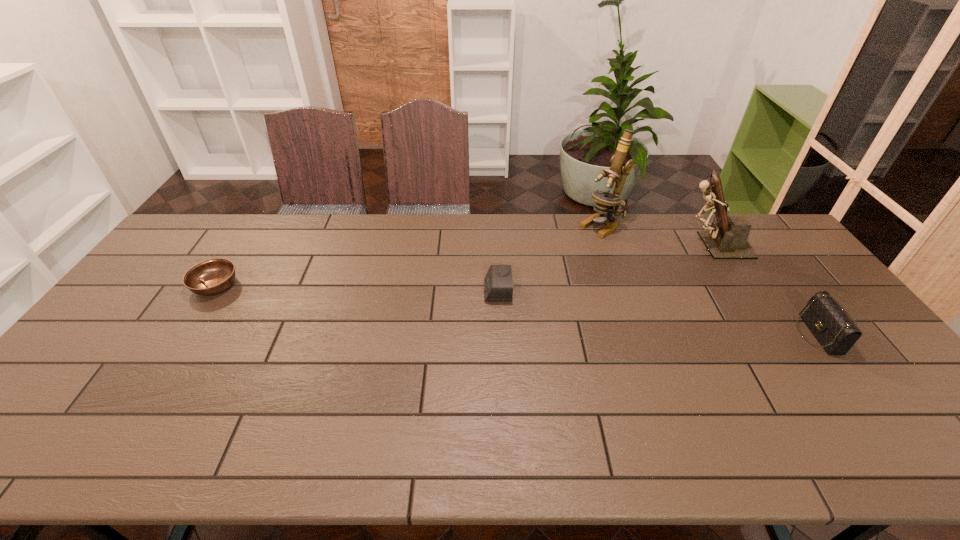
Locate an element on the screen. This screenshot has height=540, width=960. microscope is located at coordinates (606, 202).

This screenshot has height=540, width=960. What are the coordinates of `the tallest object` in the screenshot? It's located at (606, 202).

Where is `the fourth shortest object`? The width and height of the screenshot is (960, 540). the fourth shortest object is located at coordinates (727, 238).

Find the location of a particular element. This screenshot has width=960, height=540. clutch bag is located at coordinates (835, 331).

Image resolution: width=960 pixels, height=540 pixels. Find the location of `the nearest object`. the nearest object is located at coordinates (835, 331).

The height and width of the screenshot is (540, 960). Identify the location of alarm clock. (498, 285).

Where is `the second object from left to right`? Image resolution: width=960 pixels, height=540 pixels. the second object from left to right is located at coordinates (498, 285).

Find the location of a particular element. The image size is (960, 540). soup bowl is located at coordinates (212, 276).

Where is `the leftmost object`? The width and height of the screenshot is (960, 540). the leftmost object is located at coordinates (212, 276).

Image resolution: width=960 pixels, height=540 pixels. In order to click on vacant space located on the right of the tallest object in this screenshot , I will do `click(689, 226)`.